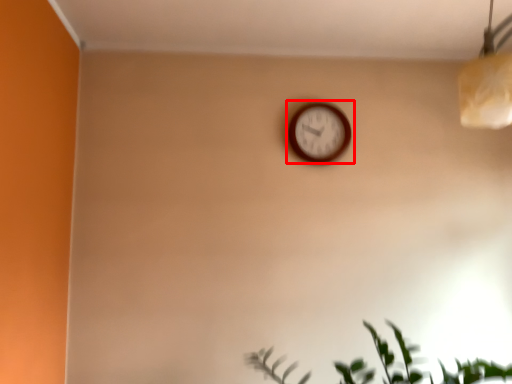
Question: From the image's perspective, where is wall clock (annotated by the red box) located in relation to houseplant in the image?

Choices:
 (A) above
 (B) below

Answer: (A)